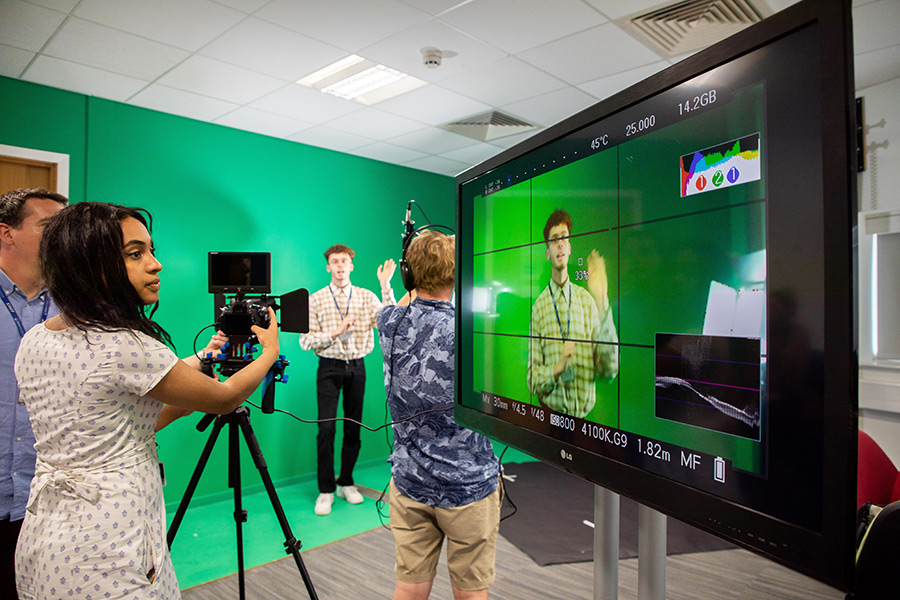
The height and width of the screenshot is (600, 900). I want to click on wood floor, so click(x=346, y=565).